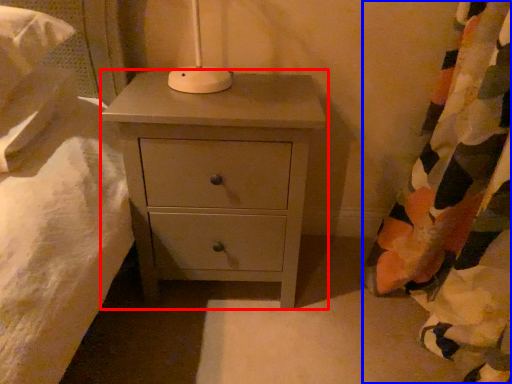
Question: Which point is further to the camera, chest of drawers (highlighted by a red box) or curtain (highlighted by a blue box)?

Choices:
 (A) chest of drawers
 (B) curtain

Answer: (A)